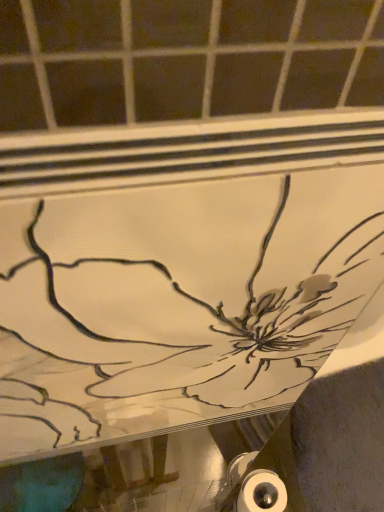
Locate an element on the screen. white glossy wheel at lower center is located at coordinates (262, 493).

Image resolution: width=384 pixels, height=512 pixels. Describe the element at coordinates (262, 493) in the screenshot. I see `white glossy wheel at lower center` at that location.

The image size is (384, 512). I want to click on white glossy wheel at lower center, so click(x=262, y=493).